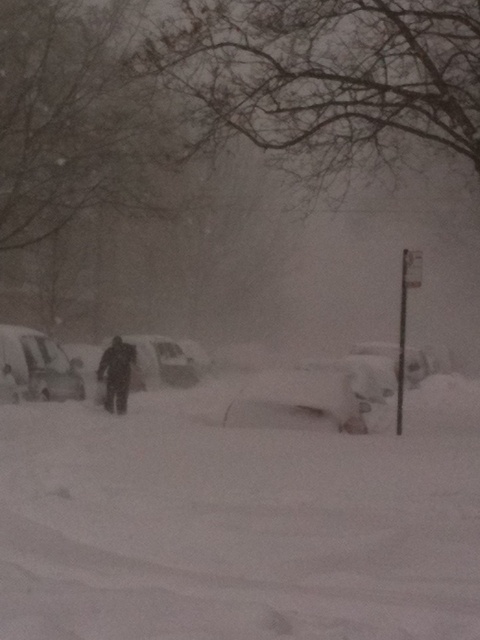
You are standing at the edge of the snowy street and see the white matte car at center. If you want to reach the car, which direction should you walk relative to the snowbank that is covering part of it?

The white matte car at center is located at point [159,364], so you should walk towards the center of the image to reach it, avoiding the snowbank covering part of the car.